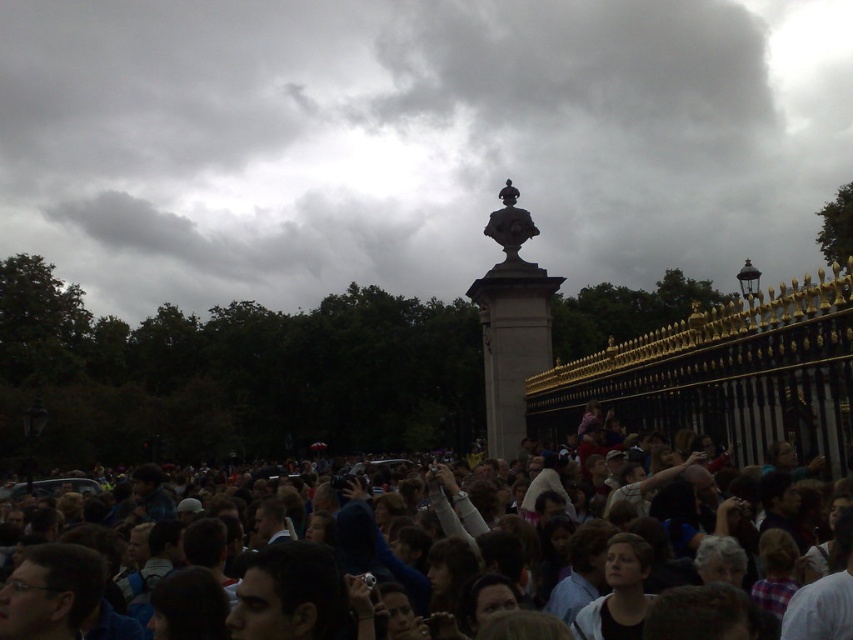
Who is shorter, dark stone column at center or dark gray crowd at center?

dark gray crowd at center

Which is behind, point (126, 99) or point (369, 529)?

The point (126, 99) is more distant.

This screenshot has width=853, height=640. Describe the element at coordinates (415, 141) in the screenshot. I see `dark stone column at center` at that location.

Locate an element on the screen. dark stone column at center is located at coordinates (415, 141).